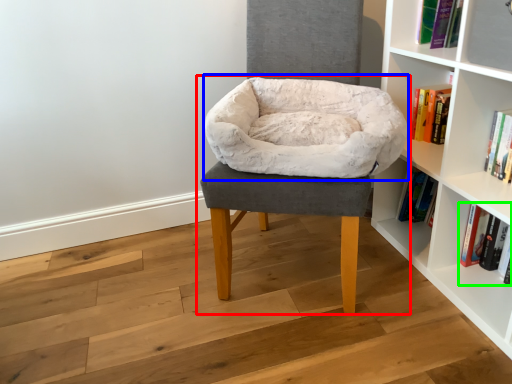
Question: Considering the real-world distances, which object is closest to chair (highlighted by a red box)? bean bag chair (highlighted by a blue box) or book (highlighted by a green box).

Choices:
 (A) bean bag chair
 (B) book

Answer: (A)